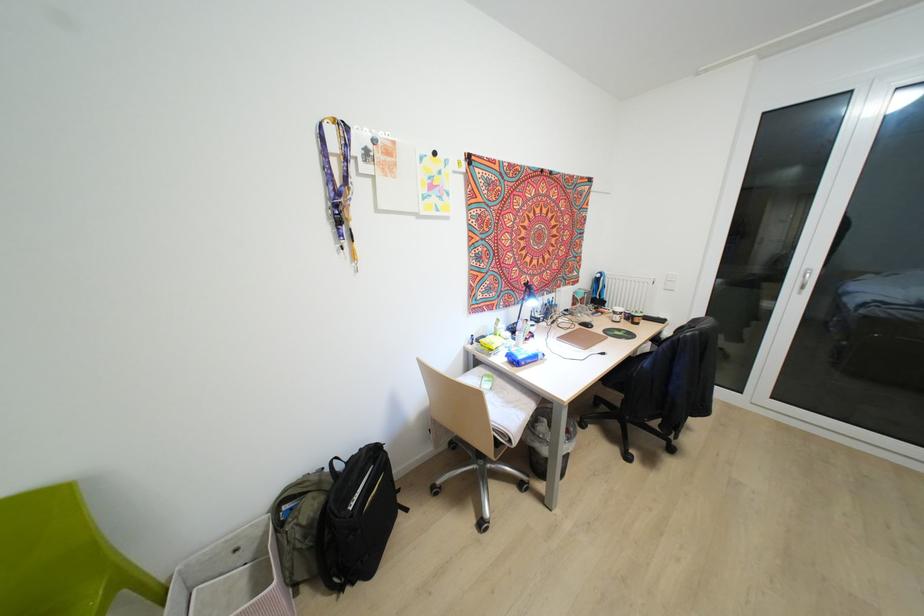
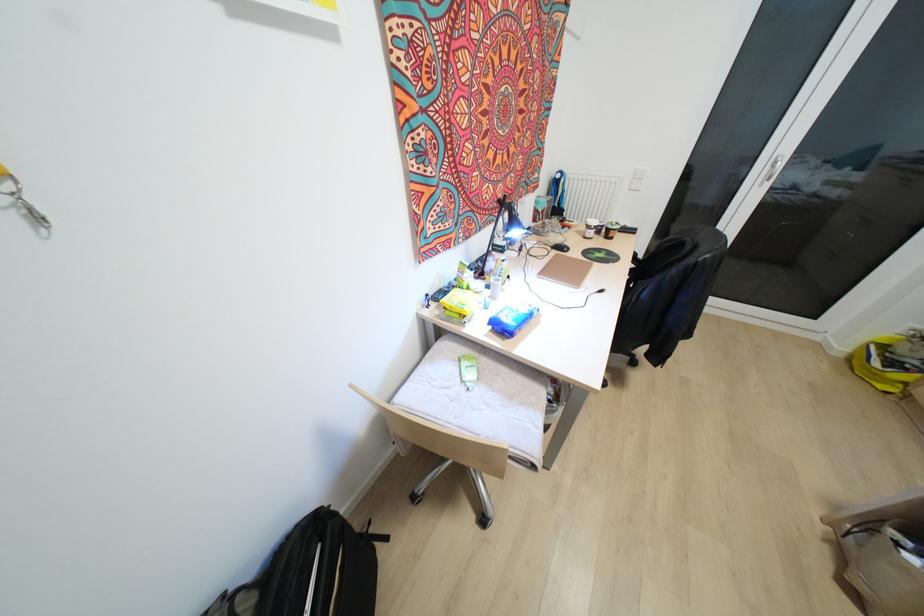
The point at (516, 345) is marked in the first image. Where is the corresponding point in the second image?

(492, 297)